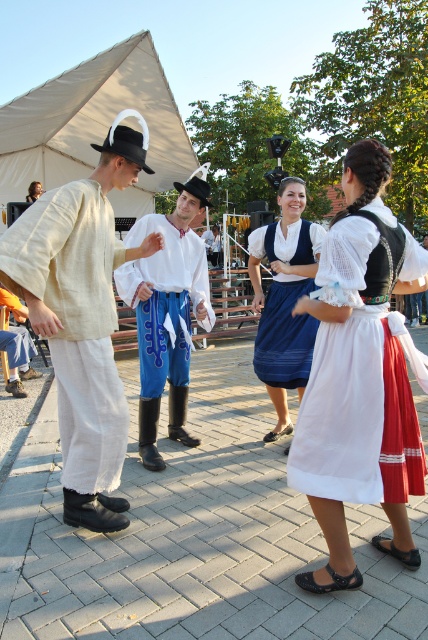
Based on the scene description, which object is positioned to the left of the other between the matte white shirt at center and the blue cotton skirt at center?

The matte white shirt at center is to the left of the blue cotton skirt at center according to the description.

You are standing in the crowd watching the performance and notice two points marked in the scene. Which point, point 1 at coordinates (119, 500) or point 2 at (291, 252), is closer to you?

Point 1 at coordinates (119, 500) is closer to you than point 2 at (291, 252).

You are a photographer at this event and want to capture a photo that includes both the white canvas tent at upper left and the blue cotton skirt at center. Based on their positions, which object should you place on the left side of your photo to ensure both are in frame?

To include both the white canvas tent at upper left and the blue cotton skirt at center in the photo, you should place the white canvas tent at upper left on the left side of your photo since it is located to the left of the blue cotton skirt at center.